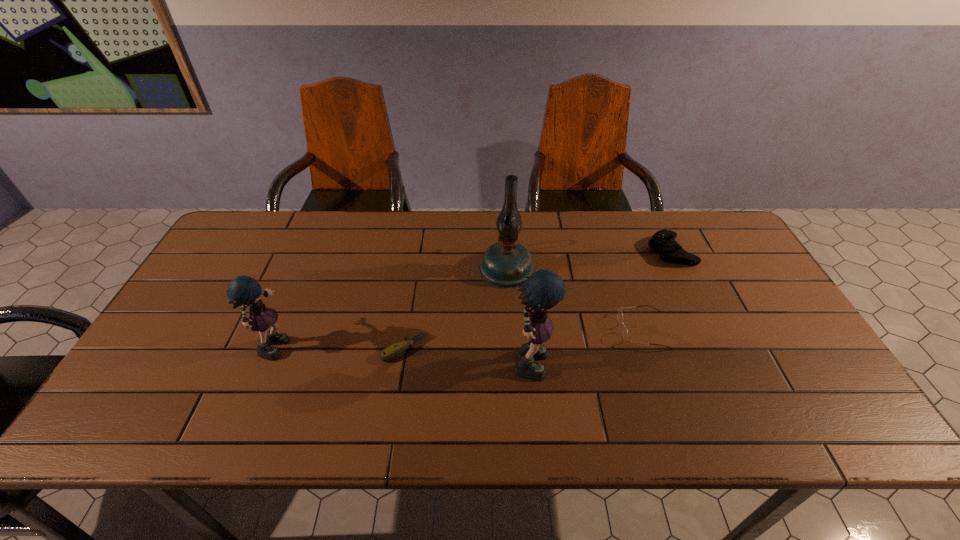
The image size is (960, 540). What are the coordinates of `vacant space located 0.060m on the front-facing side of the third tallest object` in the screenshot? It's located at (315, 343).

The width and height of the screenshot is (960, 540). Identify the location of vacant region located 0.130m on the front-facing side of the taller rag doll. coord(603,357).

Locate an element on the screen. vacant region located 0.200m on the front of the control is located at coordinates (703, 318).

The height and width of the screenshot is (540, 960). I want to click on free space located on the right of the oil lamp, so click(646, 268).

At what (x,y) coordinates should I click in order to perform the action: click on blank space located 0.210m through the lenses of the fifth object from left to right. Please return your answer as a coordinate pair (x, y). This screenshot has height=540, width=960. Looking at the image, I should click on (540, 330).

This screenshot has height=540, width=960. I want to click on vacant position located 0.180m through the lenses of the fifth object from left to right, so click(551, 330).

At what (x,y) coordinates should I click in order to perform the action: click on free location located 0.190m through the lenses of the fifth object from left to right. Please return your answer as a coordinate pair (x, y). Looking at the image, I should click on (547, 330).

You are a GUI agent. You are given a task and a screenshot of the screen. Output one action in this format:
    pyautogui.click(x=<x>, y=<y>)
    Task: Click on the free space located on the right of the shortest object
    The height and width of the screenshot is (540, 960).
    Given the screenshot: What is the action you would take?
    pyautogui.click(x=460, y=349)

In order to click on control that is positioned at the far edge in this screenshot , I will do `click(663, 241)`.

You are a GUI agent. You are given a task and a screenshot of the screen. Output one action in this format:
    pyautogui.click(x=<x>, y=<y>)
    Task: Click on the oil lamp at the far edge
    The width and height of the screenshot is (960, 540).
    Given the screenshot: What is the action you would take?
    pyautogui.click(x=505, y=264)